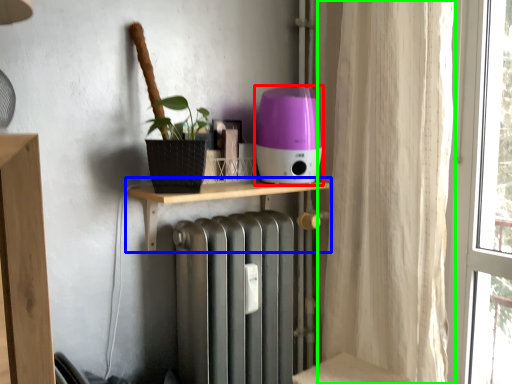
Question: Estimate the real-world distances between objects in this image. Which object is farther from appliance (highlighted by a red box), shelf (highlighted by a blue box) or curtain (highlighted by a green box)?

Choices:
 (A) shelf
 (B) curtain

Answer: (B)